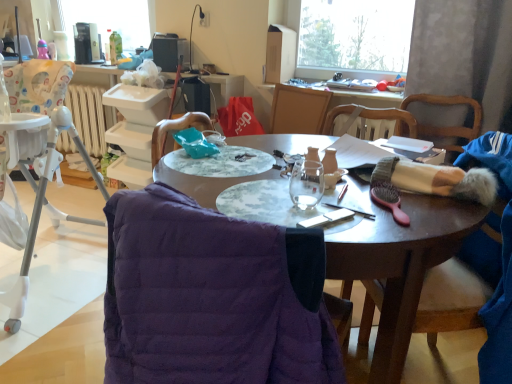
At what (x,y) coordinates should I click in order to perform the action: click on vacant area on the back side of black plastic pen at center. Please return your answer as a coordinate pair (x, y). Looking at the image, I should click on (336, 190).